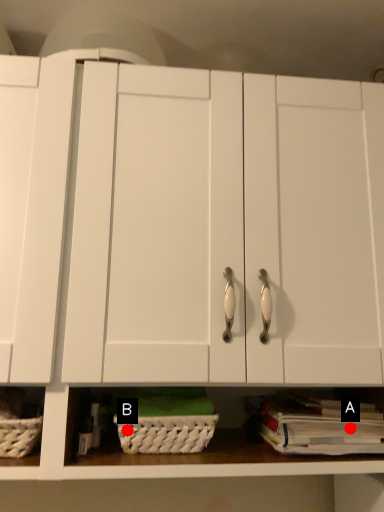
Question: Two points are circled on the image, labeled by A and B beside each circle. Which point appears farthest from the camera in this image?

Choices:
 (A) A is further
 (B) B is further

Answer: (A)